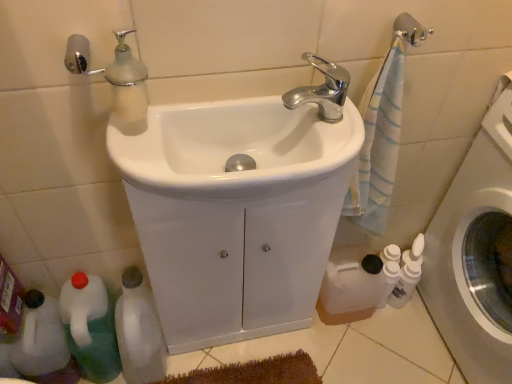
At what (x,y) coordinates should I click in order to perform the action: click on white glossy bottle at lower left, which is counted as the 2th bottle, starting from the right. Please return your answer as a coordinate pair (x, y). Image resolution: width=512 pixels, height=384 pixels. Looking at the image, I should click on (139, 331).

This screenshot has width=512, height=384. What do you see at coordinates (233, 147) in the screenshot?
I see `white glossy sink at center, acting as the first sink starting from the front` at bounding box center [233, 147].

What do you see at coordinates (389, 280) in the screenshot? I see `white matte bottle at lower right, the third bottle from the left` at bounding box center [389, 280].

At what (x,y) coordinates should I click in order to perform the action: click on white glossy sink at center, positioned as the 1th sink in back-to-front order. Please return your answer as a coordinate pair (x, y). Image resolution: width=512 pixels, height=384 pixels. Looking at the image, I should click on (234, 212).

Describe the element at coordinates (476, 253) in the screenshot. The width and height of the screenshot is (512, 384). I see `white plastic washing machine at right` at that location.

Identify the location of white plastic bottle at lower left. (40, 338).

From the image's perspective, is white glossy sink at center, which ranks as the second sink in back-to-front order, located above or below chrome metallic faucet at upper center?

white glossy sink at center, which ranks as the second sink in back-to-front order, is situated lower than chrome metallic faucet at upper center in the image.

From a real-world perspective, is white glossy sink at center, which ranks as the second sink in back-to-front order, on top of chrome metallic faucet at upper center?

No, from a real-world perspective, white glossy sink at center, which ranks as the second sink in back-to-front order, is not over chrome metallic faucet at upper center

Between white glossy sink at center, which ranks as the second sink in back-to-front order, and chrome metallic faucet at upper center, which one has less height?

With less height is white glossy sink at center, which ranks as the second sink in back-to-front order.

Is white plastic bottle at lower left, the 3th bottle in the right-to-left sequence, located within chrome metallic faucet at upper center?

No, white plastic bottle at lower left, the 3th bottle in the right-to-left sequence, is not a part of chrome metallic faucet at upper center.

Can you tell me how much chrome metallic faucet at upper center and white plastic bottle at lower left, the 1th bottle viewed from the left, differ in facing direction?

The facing directions of chrome metallic faucet at upper center and white plastic bottle at lower left, the 1th bottle viewed from the left, are 2.23 degrees apart.

From the image's perspective, which is below, chrome metallic faucet at upper center or white plastic bottle at lower left, the 1th bottle viewed from the left?

white plastic bottle at lower left, the 1th bottle viewed from the left, is shown below in the image.

Could you tell me if chrome metallic faucet at upper center is turned towards white plastic bottle at lower left, the 3th bottle in the right-to-left sequence?

No, chrome metallic faucet at upper center is not oriented towards white plastic bottle at lower left, the 3th bottle in the right-to-left sequence.

Choose the correct answer: Is white glossy sink at center, positioned as the second sink in front-to-back order, inside white glossy bottles at lower right or outside it?

white glossy sink at center, positioned as the second sink in front-to-back order, is not enclosed by white glossy bottles at lower right.

In terms of width, does white glossy sink at center, positioned as the 1th sink in back-to-front order, look wider or thinner when compared to white glossy bottles at lower right?

white glossy sink at center, positioned as the 1th sink in back-to-front order, is wider than white glossy bottles at lower right.

Between point (174, 241) and point (402, 282), which one is positioned in front?

The point (174, 241) is closer.

Can you confirm if white glossy sink at center, positioned as the second sink in front-to-back order, is shorter than white glossy bottles at lower right?

No, white glossy sink at center, positioned as the second sink in front-to-back order, is not shorter than white glossy bottles at lower right.

Is white plastic bottle at lower left, the 3th bottle in the right-to-left sequence, spatially inside white matte bottle at lower right, the third bottle from the left, or outside of it?

white plastic bottle at lower left, the 3th bottle in the right-to-left sequence, is not enclosed by white matte bottle at lower right, the third bottle from the left.

I want to click on the 2nd bottle counting from the right side of the white plastic bottle at lower left, the 1th bottle viewed from the left, so click(389, 280).

Does point (106, 341) come closer to viewer compared to point (388, 293)?

Yes, point (106, 341) is closer to viewer.

Considering the relative sizes of white plastic bottle at lower left, the 3th bottle in the right-to-left sequence, and white matte bottle at lower right, acting as the first bottle starting from the right, in the image provided, is white plastic bottle at lower left, the 3th bottle in the right-to-left sequence, taller than white matte bottle at lower right, acting as the first bottle starting from the right,?

Indeed, white plastic bottle at lower left, the 3th bottle in the right-to-left sequence, has a greater height compared to white matte bottle at lower right, acting as the first bottle starting from the right.

Which is in front, point (404, 280) or point (282, 121)?

The point (282, 121) is closer.

Looking at their sizes, would you say white glossy bottles at lower right is wider or thinner than white glossy sink at center, acting as the first sink starting from the front?

white glossy bottles at lower right is thinner than white glossy sink at center, acting as the first sink starting from the front.

From a real-world perspective, does white glossy bottles at lower right sit lower than white glossy sink at center, which ranks as the second sink in back-to-front order?

Yes, from a real-world perspective, white glossy bottles at lower right is under white glossy sink at center, which ranks as the second sink in back-to-front order.

From the silver metallic towel bar at upper right, count 1st bottles backward and point to it. Please provide its 2D coordinates.

[(90, 327)]

Who is bigger, silver metallic towel bar at upper right or white plastic bottle at lower left, the 3th bottle in the right-to-left sequence?

With larger size is white plastic bottle at lower left, the 3th bottle in the right-to-left sequence.

Considering the positions of objects silver metallic towel bar at upper right and white plastic bottle at lower left, the 1th bottle viewed from the left, in the image provided, who is more to the right, silver metallic towel bar at upper right or white plastic bottle at lower left, the 1th bottle viewed from the left,?

silver metallic towel bar at upper right.

How different are the orientations of silver metallic towel bar at upper right and white plastic bottle at lower left, the 3th bottle in the right-to-left sequence, in degrees?

4.76 degrees.

From a real-world perspective, is white glossy bottles at lower right physically below white plastic bottle at lower left, the 3th bottle in the right-to-left sequence?

Indeed, from a real-world perspective, white glossy bottles at lower right is positioned beneath white plastic bottle at lower left, the 3th bottle in the right-to-left sequence.

Is white glossy bottles at lower right completely or partially outside of white plastic bottle at lower left, the 1th bottle viewed from the left?

Yes.

Is white glossy bottles at lower right not near white plastic bottle at lower left, the 3th bottle in the right-to-left sequence?

white glossy bottles at lower right is near white plastic bottle at lower left, the 3th bottle in the right-to-left sequence, not far away.

Which object is more forward, white glossy bottles at lower right or white plastic bottle at lower left, the 3th bottle in the right-to-left sequence?

white plastic bottle at lower left, the 3th bottle in the right-to-left sequence, is closer to the camera.

This screenshot has width=512, height=384. Find the location of `sink that is the 1st one when counting downward from the chrome metallic faucet at upper center (from the image's perspective)`. sink that is the 1st one when counting downward from the chrome metallic faucet at upper center (from the image's perspective) is located at coordinates (233, 147).

You are a GUI agent. You are given a task and a screenshot of the screen. Output one action in this format:
    pyautogui.click(x=<x>, y=<y>)
    Task: Click on the tap that appears above the white plastic bottle at lower left, the 3th bottle in the right-to-left sequence (from the image's perspective)
    
    Given the screenshot: What is the action you would take?
    pyautogui.click(x=322, y=90)

Considering their positions, is white glossy sink at center, positioned as the 1th sink in back-to-front order, positioned closer to silver metallic towel bar at upper right than chrome metallic faucet at upper center?

chrome metallic faucet at upper center lies closer to silver metallic towel bar at upper right than the other object.

Which object lies further to the anchor point white glossy bottles at lower right, chrome metallic faucet at upper center or white plastic washing machine at right?

chrome metallic faucet at upper center is positioned further to the anchor white glossy bottles at lower right.

From the image, which object appears to be nearer to white matte bottle at lower right, acting as the first bottle starting from the right, silver metallic towel bar at upper right or chrome metallic faucet at upper center?

chrome metallic faucet at upper center is positioned closer to the anchor white matte bottle at lower right, acting as the first bottle starting from the right.

Which object lies nearer to the anchor point white glossy sink at center, acting as the first sink starting from the front, white matte bottle at lower right, acting as the first bottle starting from the right, or chrome metallic faucet at upper center?

chrome metallic faucet at upper center.

Which object lies nearer to the anchor point white glossy bottles at lower right, white matte bottle at lower right, acting as the first bottle starting from the right, or chrome metallic faucet at upper center?

white matte bottle at lower right, acting as the first bottle starting from the right, is positioned closer to the anchor white glossy bottles at lower right.

Based on their spatial positions, is white glossy sink at center, positioned as the 1th sink in back-to-front order, or silver metallic towel bar at upper right further from white plastic bottle at lower left, the 3th bottle in the right-to-left sequence?

The object further to white plastic bottle at lower left, the 3th bottle in the right-to-left sequence, is silver metallic towel bar at upper right.

Which object lies further to the anchor point chrome metallic faucet at upper center, white matte bottle at lower right, the third bottle from the left, or white glossy sink at center, acting as the first sink starting from the front?

white matte bottle at lower right, the third bottle from the left, is further to chrome metallic faucet at upper center.

When comparing their distances from white matte bottle at lower right, acting as the first bottle starting from the right, does chrome metallic faucet at upper center or white plastic washing machine at right seem closer?

The object closer to white matte bottle at lower right, acting as the first bottle starting from the right, is white plastic washing machine at right.

Find the location of a particular element. toiletry located between white plastic bottle at lower left, the 3th bottle in the right-to-left sequence, and white plastic washing machine at right in the left-right direction is located at coordinates (405, 284).

Where is `toiletry situated between white plastic bottle at lower left and white plastic washing machine at right from left to right`? The height and width of the screenshot is (384, 512). toiletry situated between white plastic bottle at lower left and white plastic washing machine at right from left to right is located at coordinates (405, 284).

You are a GUI agent. You are given a task and a screenshot of the screen. Output one action in this format:
    pyautogui.click(x=<x>, y=<y>)
    Task: Click on the sink between white plastic bottle at lower left and white glossy sink at center, which ranks as the second sink in back-to-front order, from left to right
    
    Given the screenshot: What is the action you would take?
    pyautogui.click(x=234, y=212)

Where is `tap between white glossy bottle at lower left, which is counted as the 2th bottle, starting from the right, and white glossy bottles at lower right from left to right`? This screenshot has width=512, height=384. tap between white glossy bottle at lower left, which is counted as the 2th bottle, starting from the right, and white glossy bottles at lower right from left to right is located at coordinates (322, 90).